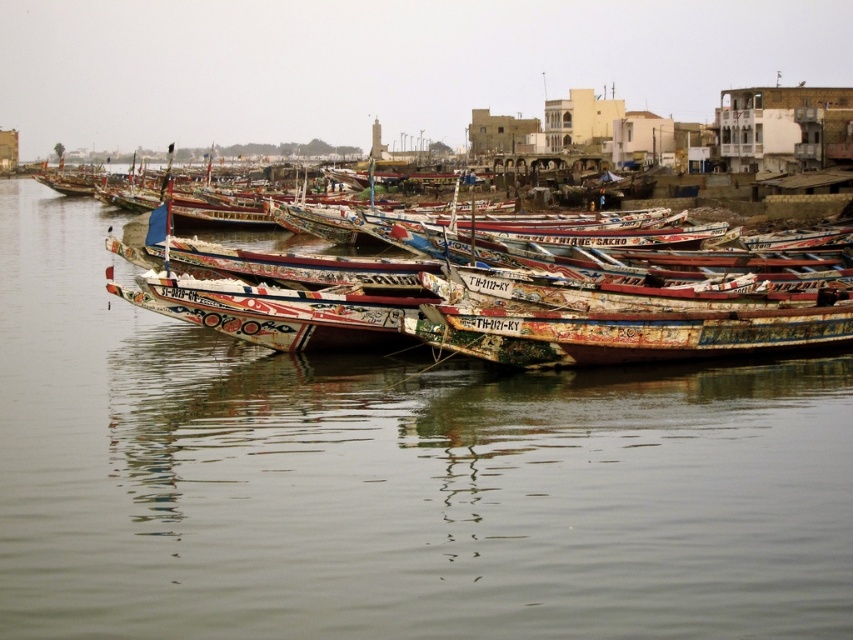
Question: Which point appears closest to the camera in this image?

Choices:
 (A) tap(613, 285)
 (B) tap(485, 529)

Answer: (B)

Question: Is painted wooden boats at center closer to camera compared to painted wooden boat at center?

Choices:
 (A) no
 (B) yes

Answer: (B)

Question: Which point is closer to the camera taking this photo?

Choices:
 (A) (59, 522)
 (B) (659, 292)

Answer: (A)

Question: In this image, where is painted wooden boats at center located relative to painted wooden boat at center?

Choices:
 (A) above
 (B) below

Answer: (B)

Question: Can you confirm if painted wooden boats at center is positioned below painted wooden boat at center?

Choices:
 (A) no
 (B) yes

Answer: (B)